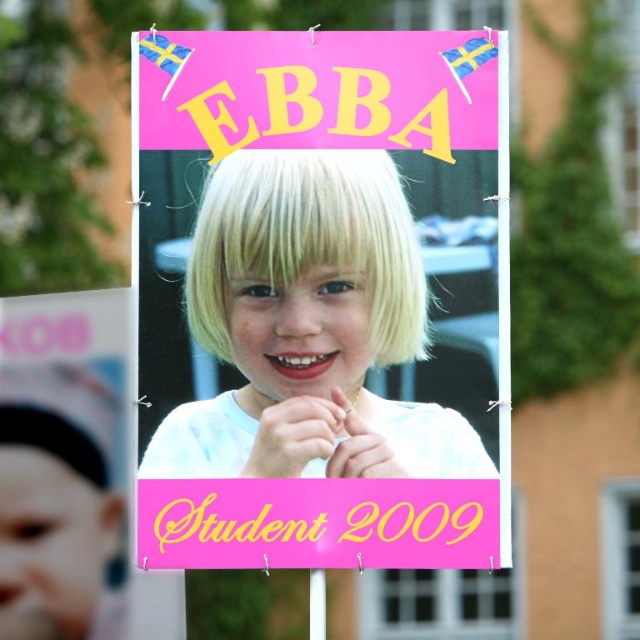
Question: Which object is closer to the camera taking this photo?

Choices:
 (A) white paper photo at center
 (B) matte white headband at left

Answer: (A)

Question: Which point is farther from the camera taking this photo?

Choices:
 (A) (490, 58)
 (B) (93, 529)

Answer: (B)

Question: From the image, what is the correct spatial relationship of white paper photo at center in relation to matte white headband at left?

Choices:
 (A) below
 (B) above

Answer: (B)

Question: Is white paper photo at center smaller than matte white headband at left?

Choices:
 (A) no
 (B) yes

Answer: (A)

Question: Can you confirm if white paper photo at center is smaller than matte white headband at left?

Choices:
 (A) no
 (B) yes

Answer: (A)

Question: Which of the following is the closest to the observer?

Choices:
 (A) (301, 556)
 (B) (90, 468)

Answer: (A)